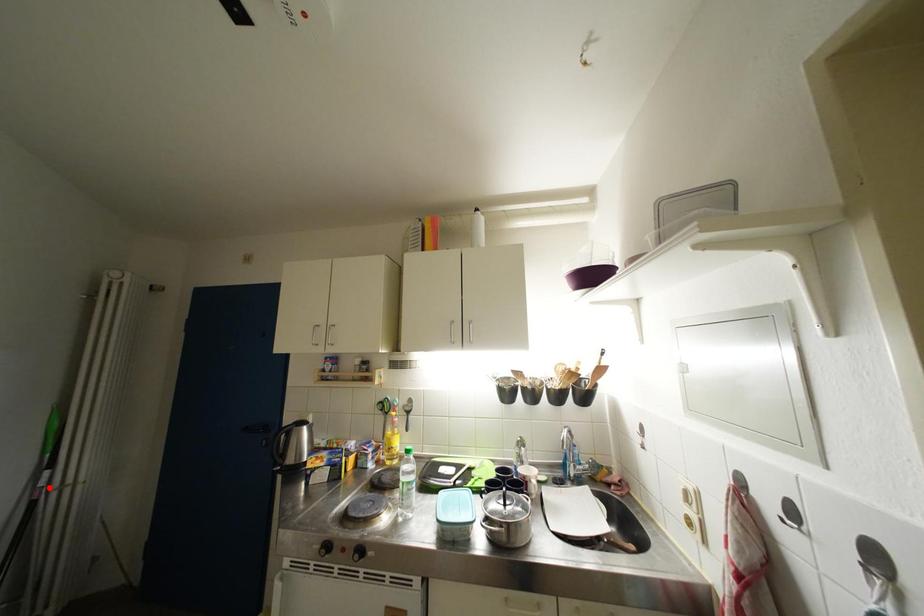
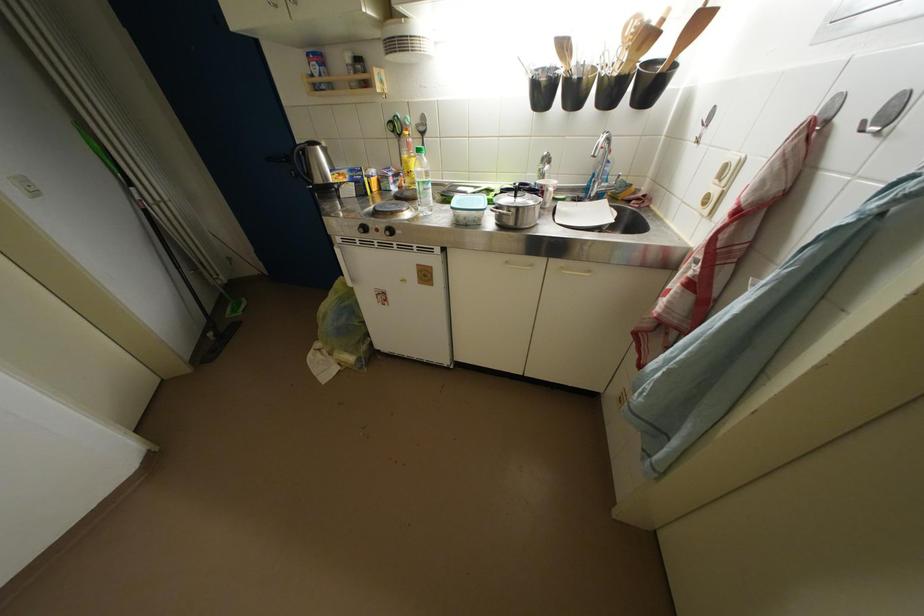
Find the pixel in the second image that matches the highlighted location in the first image.

(144, 201)